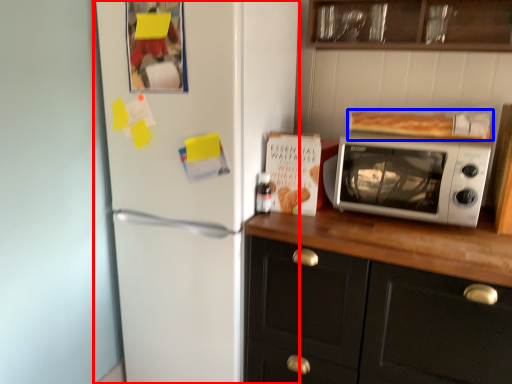
Question: Among these objects, which one is farthest to the camera, refrigerator (highlighted by a red box) or food (highlighted by a blue box)?

Choices:
 (A) refrigerator
 (B) food

Answer: (B)